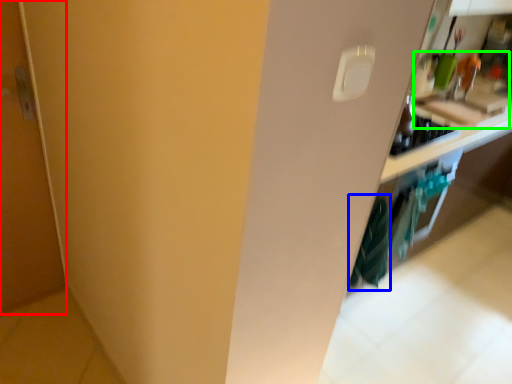
Question: Estimate the real-world distances between objects in this image. Which object is closer to door (highlighted by a red box), laundry (highlighted by a blue box) or sink (highlighted by a green box)?

Choices:
 (A) laundry
 (B) sink

Answer: (A)